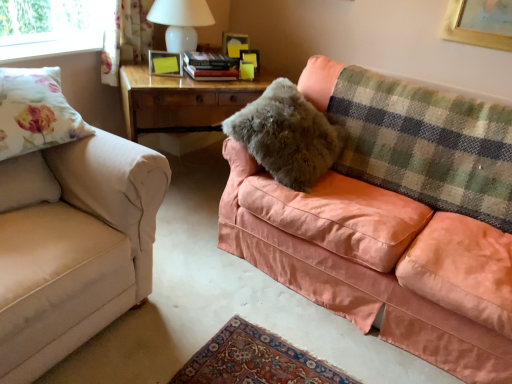
In order to click on beige fabric couch at left, marked as the 2th studio couch in a right-to-left arrangement in this screenshot , I will do `click(73, 245)`.

In order to face fuzzy gray pillow at upper right, which ranks as the 1th pillow in back-to-front order, should I rotate leftwards or rightwards?

You should rotate right by 4.610 degrees.

What do you see at coordinates (181, 22) in the screenshot? I see `white glossy table lamp at upper center` at bounding box center [181, 22].

Find the location of a particular element. This screenshot has width=512, height=384. white glossy table lamp at upper center is located at coordinates (181, 22).

In order to face matte yellow picture frame at center, which ranks as the second picture frame in right-to-left order, should I rotate leftwards or rightwards?

A 11.856 degree turn to the left will do.

In order to face matte black picture frame at upper center, which is the first picture frame from right to left, should I rotate leftwards or rightwards?

It's best to rotate left around 2.414 degrees.

The image size is (512, 384). In order to click on green plaid blanket at upper right in this screenshot , I will do `click(426, 144)`.

Image resolution: width=512 pixels, height=384 pixels. Identify the location of beige fabric couch at left, marked as the 2th studio couch in a right-to-left arrangement. (73, 245).

Does point (163, 61) appear closer or farther from the camera than point (108, 30)?

Clearly, point (163, 61) is closer to the camera than point (108, 30).

Would you consider matte yellow picture frame at center, the first picture frame viewed from the front, to be distant from floral fabric curtain at upper left?

matte yellow picture frame at center, the first picture frame viewed from the front, is actually quite close to floral fabric curtain at upper left.

Looking at their sizes, would you say matte yellow picture frame at center, the first picture frame viewed from the front, is wider or thinner than floral fabric curtain at upper left?

Considering their sizes, matte yellow picture frame at center, the first picture frame viewed from the front, looks slimmer than floral fabric curtain at upper left.

From the image's perspective, between matte yellow picture frame at center, the first picture frame from the bottom, and floral fabric curtain at upper left, which one is located above?

floral fabric curtain at upper left, from the image's perspective.

Which object is further away from the camera taking this photo, matte yellow picture frame at center, the second picture frame from the top, or fuzzy gray pillow at upper right, the first pillow in the right-to-left sequence?

matte yellow picture frame at center, the second picture frame from the top, is further from the camera.

Are matte yellow picture frame at center, the first picture frame from the bottom, and fuzzy gray pillow at upper right, which ranks as the 1th pillow in back-to-front order, far apart?

No, matte yellow picture frame at center, the first picture frame from the bottom, is not far away from fuzzy gray pillow at upper right, which ranks as the 1th pillow in back-to-front order.

From a real-world perspective, is matte yellow picture frame at center, placed as the first picture frame when sorted from left to right, located beneath fuzzy gray pillow at upper right, the first pillow in the right-to-left sequence?

Actually, matte yellow picture frame at center, placed as the first picture frame when sorted from left to right, is physically above fuzzy gray pillow at upper right, the first pillow in the right-to-left sequence, in the real world.

Does matte yellow picture frame at center, the second picture frame from the top, contain fuzzy gray pillow at upper right, the first pillow in the right-to-left sequence?

No, matte yellow picture frame at center, the second picture frame from the top, does not contain fuzzy gray pillow at upper right, the first pillow in the right-to-left sequence.

Can you confirm if green plaid blanket at upper right is taller than floral fabric pillow at left, the first pillow in the front-to-back sequence?

Yes.

In the scene shown: Is green plaid blanket at upper right inside the boundaries of floral fabric pillow at left, the first pillow in the front-to-back sequence, or outside?

green plaid blanket at upper right is located beyond the bounds of floral fabric pillow at left, the first pillow in the front-to-back sequence.

Can you confirm if green plaid blanket at upper right is wider than floral fabric pillow at left, the first pillow in the front-to-back sequence?

Correct, the width of green plaid blanket at upper right exceeds that of floral fabric pillow at left, the first pillow in the front-to-back sequence.

Considering the relative positions of matte black picture frame at upper center, placed as the 2th picture frame when sorted from left to right, and white glossy table lamp at upper center in the image provided, is matte black picture frame at upper center, placed as the 2th picture frame when sorted from left to right, in front of white glossy table lamp at upper center?

No, the depth of matte black picture frame at upper center, placed as the 2th picture frame when sorted from left to right, is greater than that of white glossy table lamp at upper center.

What are the coordinates of `table lamp on the left side of matte black picture frame at upper center, which is the first picture frame from right to left` in the screenshot? It's located at (181, 22).

In terms of height, does matte black picture frame at upper center, marked as the first picture frame in a top-to-bottom arrangement, look taller or shorter compared to white glossy table lamp at upper center?

matte black picture frame at upper center, marked as the first picture frame in a top-to-bottom arrangement, is shorter than white glossy table lamp at upper center.

Consider the image. Is beige fabric couch at left, marked as the 2th studio couch in a right-to-left arrangement, outside of floral fabric pillow at left?

beige fabric couch at left, marked as the 2th studio couch in a right-to-left arrangement, is positioned outside floral fabric pillow at left.

From the image's perspective, which object appears higher, beige fabric couch at left, arranged as the 1th studio couch when viewed from the left, or floral fabric pillow at left?

A: floral fabric pillow at left, from the image's perspective.

Is beige fabric couch at left, marked as the 2th studio couch in a right-to-left arrangement, aimed at floral fabric pillow at left?

No, beige fabric couch at left, marked as the 2th studio couch in a right-to-left arrangement, is not aimed at floral fabric pillow at left.

How different are the orientations of beige fabric couch at left, marked as the 2th studio couch in a right-to-left arrangement, and floral fabric pillow at left in degrees?

The facing directions of beige fabric couch at left, marked as the 2th studio couch in a right-to-left arrangement, and floral fabric pillow at left are 22 degrees apart.

Is matte yellow picture frame at center, which ranks as the second picture frame in right-to-left order, wider than floral fabric pillow at left, the 2th pillow viewed from the right?

In fact, matte yellow picture frame at center, which ranks as the second picture frame in right-to-left order, might be narrower than floral fabric pillow at left, the 2th pillow viewed from the right.

Considering their positions, is matte yellow picture frame at center, placed as the second picture frame when sorted from back to front, located in front of or behind floral fabric pillow at left, the 2th pillow viewed from the right?

matte yellow picture frame at center, placed as the second picture frame when sorted from back to front, is behind floral fabric pillow at left, the 2th pillow viewed from the right.

Considering the sizes of objects matte yellow picture frame at center, placed as the first picture frame when sorted from left to right, and floral fabric pillow at left, which is the 2th pillow from back to front, in the image provided, who is smaller, matte yellow picture frame at center, placed as the first picture frame when sorted from left to right, or floral fabric pillow at left, which is the 2th pillow from back to front,?

Smaller between the two is matte yellow picture frame at center, placed as the first picture frame when sorted from left to right.

Could you tell me if white glossy table lamp at upper center is turned towards floral fabric pillow at left?

No, white glossy table lamp at upper center is not aimed at floral fabric pillow at left.

In terms of height, does white glossy table lamp at upper center look taller or shorter compared to floral fabric pillow at left?

In the image, white glossy table lamp at upper center appears to be taller than floral fabric pillow at left.

Considering the sizes of objects white glossy table lamp at upper center and floral fabric pillow at left in the image provided, who is bigger, white glossy table lamp at upper center or floral fabric pillow at left?

With larger size is white glossy table lamp at upper center.

What's the angular difference between white glossy table lamp at upper center and floral fabric pillow at left's facing directions?

The angle between the facing direction of white glossy table lamp at upper center and the facing direction of floral fabric pillow at left is 15.6 degrees.

You are a GUI agent. You are given a task and a screenshot of the screen. Output one action in this format:
    pyautogui.click(x=<x>, y=<y>)
    Task: Click on the 2nd picture frame below the floral fabric curtain at upper left (from the image's perspective)
    
    Given the screenshot: What is the action you would take?
    pyautogui.click(x=165, y=63)

I want to click on picture frame that is the 1st object located above the fuzzy gray pillow at upper right, which ranks as the 1th pillow in back-to-front order (from the image's perspective), so click(165, 63).

When comparing their distances from green plaid blanket at upper right, does coral velvet couch at right, the 1th studio couch in the right-to-left sequence, or white glossy table lamp at upper center seem further?

white glossy table lamp at upper center is further to green plaid blanket at upper right.

Estimate the real-world distances between objects in this image. Which object is further from green plaid blanket at upper right, fuzzy gray pillow at upper right, which ranks as the 1th pillow in back-to-front order, or coral velvet couch at right, which is the second studio couch from left to right?

The object further to green plaid blanket at upper right is coral velvet couch at right, which is the second studio couch from left to right.

From the picture: Considering their positions, is floral fabric pillow at left positioned further to beige fabric couch at left, marked as the 2th studio couch in a right-to-left arrangement, than floral fabric curtain at upper left?

floral fabric curtain at upper left is positioned further to the anchor beige fabric couch at left, marked as the 2th studio couch in a right-to-left arrangement.

Estimate the real-world distances between objects in this image. Which object is closer to wooden table at center, matte yellow picture frame at center, placed as the second picture frame when sorted from back to front, or coral velvet couch at right, the 1th studio couch in the right-to-left sequence?

matte yellow picture frame at center, placed as the second picture frame when sorted from back to front, is closer to wooden table at center.

When comparing their distances from floral fabric curtain at upper left, does coral velvet couch at right, the 1th studio couch in the right-to-left sequence, or matte yellow picture frame at center, the second picture frame from the top, seem closer?

matte yellow picture frame at center, the second picture frame from the top.

Considering their positions, is wooden table at center positioned further to matte yellow picture frame at center, the first picture frame from the bottom, than white glossy table lamp at upper center?

wooden table at center is positioned further to the anchor matte yellow picture frame at center, the first picture frame from the bottom.

Estimate the real-world distances between objects in this image. Which object is closer to white glossy table lamp at upper center, wooden table at center or fuzzy gray pillow at upper right, the first pillow in the right-to-left sequence?

wooden table at center is closer to white glossy table lamp at upper center.

From the image, which object appears to be nearer to beige fabric couch at left, marked as the 2th studio couch in a right-to-left arrangement, floral fabric pillow at left, positioned as the 1th pillow in left-to-right order, or fuzzy gray pillow at upper right, the 2th pillow in the left-to-right sequence?

Among the two, floral fabric pillow at left, positioned as the 1th pillow in left-to-right order, is located nearer to beige fabric couch at left, marked as the 2th studio couch in a right-to-left arrangement.

Identify the location of table between floral fabric pillow at left, which is the 2th pillow from back to front, and matte yellow picture frame at center, the first picture frame from the bottom, in the front-back direction. (181, 101).

You are a GUI agent. You are given a task and a screenshot of the screen. Output one action in this format:
    pyautogui.click(x=<x>, y=<y>)
    Task: Click on the table located between floral fabric pillow at left and white glossy table lamp at upper center in the depth direction
    This screenshot has width=512, height=384.
    Given the screenshot: What is the action you would take?
    pyautogui.click(x=181, y=101)

Locate an element on the screen. The width and height of the screenshot is (512, 384). table lamp situated between floral fabric pillow at left, the 2th pillow viewed from the right, and coral velvet couch at right, the 1th studio couch in the right-to-left sequence, from left to right is located at coordinates (181, 22).

Where is `throw pillow situated between floral fabric pillow at left, positioned as the 1th pillow in left-to-right order, and coral velvet couch at right, which is the second studio couch from left to right, from left to right`? This screenshot has width=512, height=384. throw pillow situated between floral fabric pillow at left, positioned as the 1th pillow in left-to-right order, and coral velvet couch at right, which is the second studio couch from left to right, from left to right is located at coordinates (35, 112).